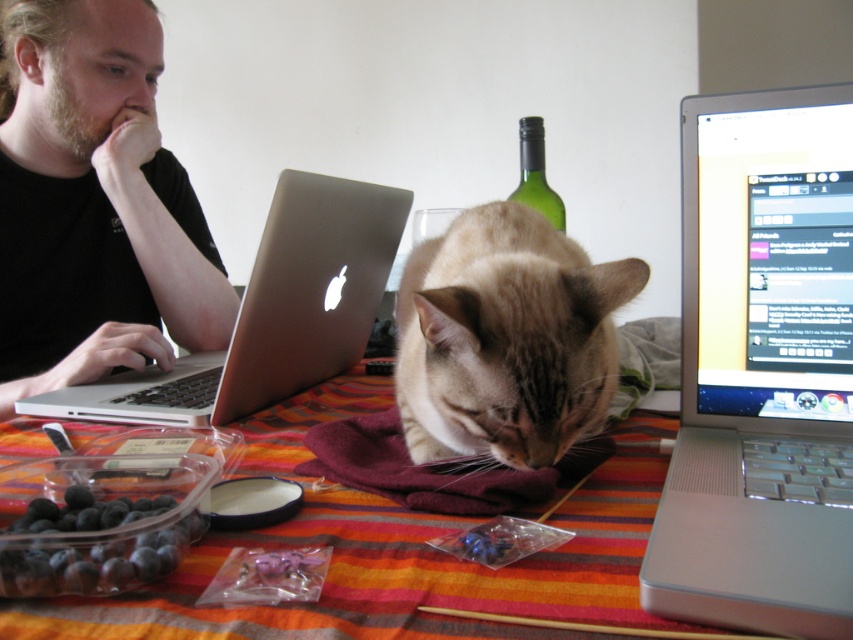
You are organizing a small space and need to place both the silver metallic laptop at upper right and the dark blue glossy berries at lower left on a shelf. Given their sizes, which one should you place first to ensure they both fit?

The silver metallic laptop at upper right is bigger than dark blue glossy berries at lower left, so you should place the silver metallic laptop at upper right first to ensure there is enough space for both items.

Please describe the position of the light brown fur cat at center in terms of coordinates.

The light brown fur cat at center is located at coordinates approximately 0.530 in the x direction and 0.594 in the y direction.